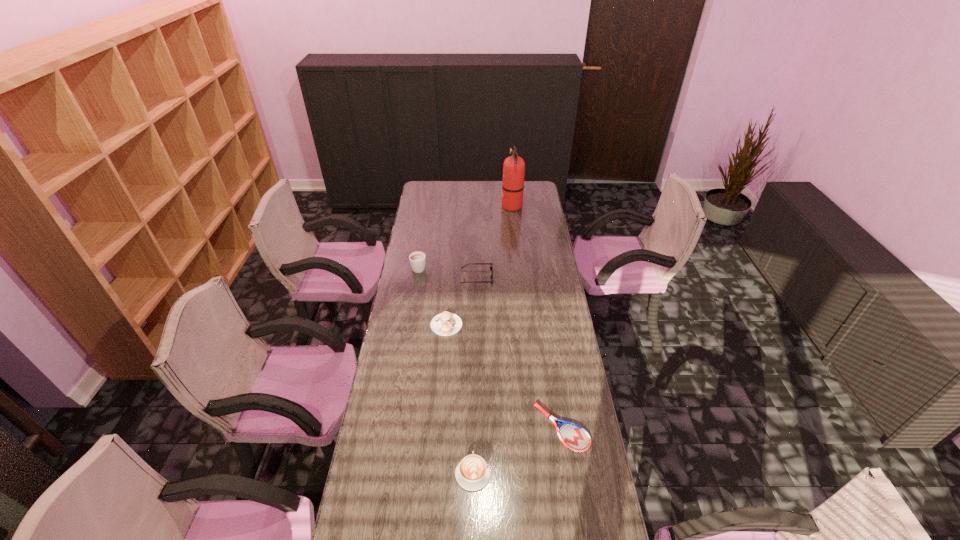
This screenshot has height=540, width=960. What are the coordinates of `blank space at the right edge of the desktop` in the screenshot? It's located at (531, 262).

Where is `free location at the far left corner`? free location at the far left corner is located at coordinates (440, 187).

In order to click on empty space that is in between the tallest cappuccino and the tennis racket in this screenshot , I will do `click(491, 348)`.

Find the location of a particular element. Image resolution: width=960 pixels, height=540 pixels. vacant space that's between the tallest cappuccino and the fire extinguisher is located at coordinates (466, 237).

Where is `free space between the nearest cappuccino and the shortest object`? The image size is (960, 540). free space between the nearest cappuccino and the shortest object is located at coordinates (517, 450).

Find the location of `free spot between the shortest object and the fire extinguisher`. free spot between the shortest object and the fire extinguisher is located at coordinates (537, 317).

You are a GUI agent. You are given a task and a screenshot of the screen. Output one action in this format:
    pyautogui.click(x=<x>, y=<y>)
    Task: Click on the free space that is in between the third tallest object and the fourth tallest object
    This screenshot has height=540, width=960.
    Given the screenshot: What is the action you would take?
    pyautogui.click(x=475, y=375)

This screenshot has height=540, width=960. Identify the location of unoccupied area between the third shortest object and the tallest object. (492, 340).

The height and width of the screenshot is (540, 960). I want to click on empty location between the fourth shortest object and the farthest object, so click(x=494, y=241).

You are a GUI agent. You are given a task and a screenshot of the screen. Output one action in this format:
    pyautogui.click(x=<x>, y=<y>)
    Task: Click on the vacant space that's between the fifth tallest object and the sunglasses
    
    Given the screenshot: What is the action you would take?
    pyautogui.click(x=462, y=301)